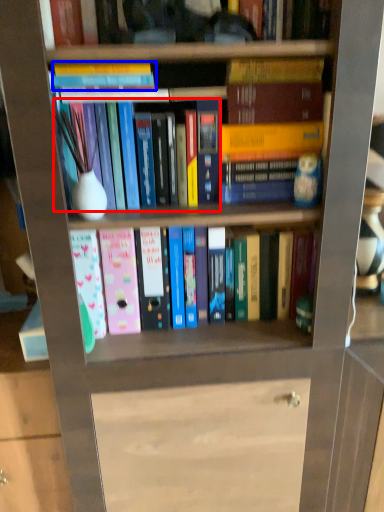
Question: Among these objects, which one is nearest to the camera, book (highlighted by a red box) or book (highlighted by a blue box)?

Choices:
 (A) book
 (B) book

Answer: (B)